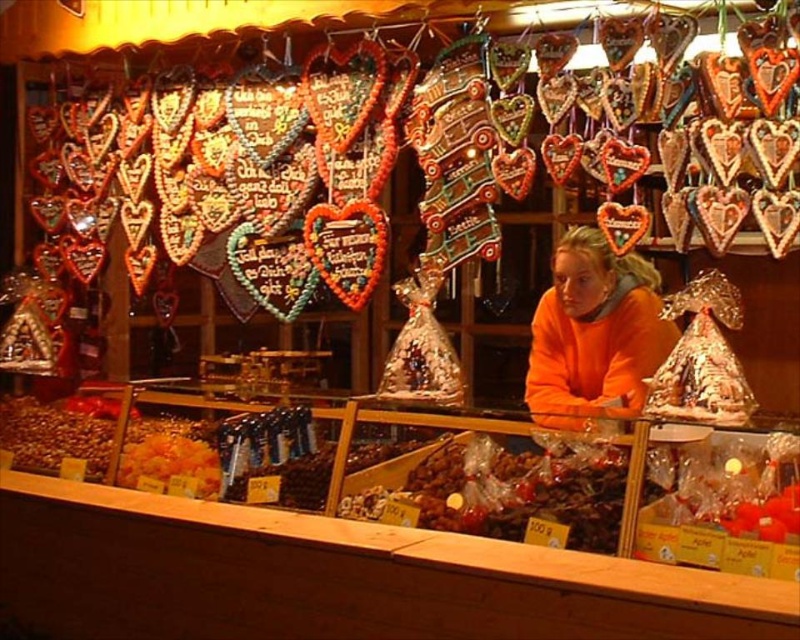
You are at the market stall and want to buy both the translucent plastic candy at center and the orange fleece at center. If you start from the left side of the counter, which item should you pick up first?

Since the translucent plastic candy at center is to the left of orange fleece at center, you should pick up the translucent plastic candy at center first when starting from the left side of the counter.

You are at the market stall and want to buy both the translucent plastic candy at center and the orange fleece at center. The cashier says the counter can only accommodate items that are narrower than 30 cm. Can you determine which item might not fit on the counter?

The translucent plastic candy at center is wider than the orange fleece at center. Since the counter can only accommodate items narrower than 30 cm, the translucent plastic candy at center might not fit if its width exceeds 30 cm, while the orange fleece at center could fit as it is narrower.